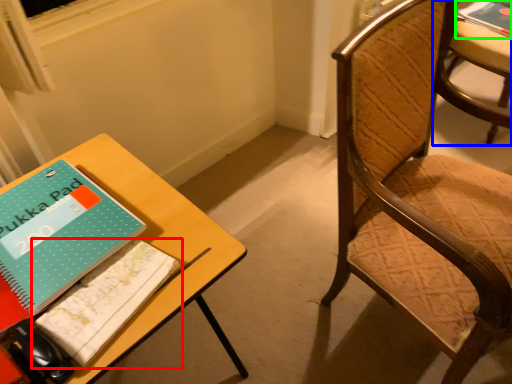
Question: Considering the real-world distances, which object is farthest from book (highlighted by a red box)? chair (highlighted by a blue box) or book (highlighted by a green box)?

Choices:
 (A) chair
 (B) book

Answer: (B)